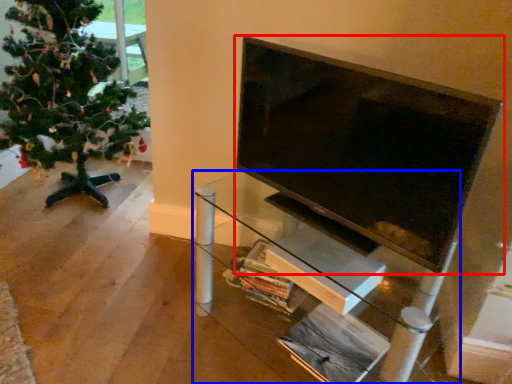
Question: Which object is further to the camera taking this photo, television (highlighted by a red box) or furniture (highlighted by a blue box)?

Choices:
 (A) television
 (B) furniture

Answer: (B)